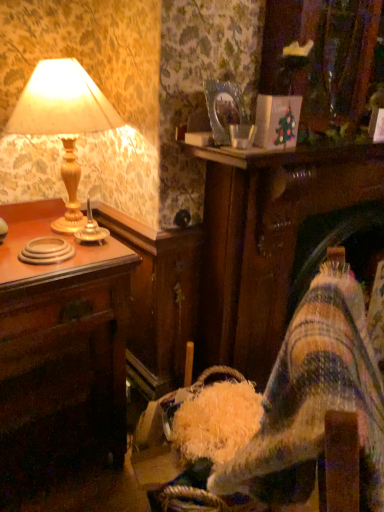
Question: Considering the positions of point (87, 222) and point (39, 87), is point (87, 222) closer or farther from the camera than point (39, 87)?

Choices:
 (A) farther
 (B) closer

Answer: (A)

Question: Considering the positions of gold metallic candle holder at left and matte gold lamp at left in the image, is gold metallic candle holder at left wider or thinner than matte gold lamp at left?

Choices:
 (A) thin
 (B) wide

Answer: (A)

Question: Which of these objects is positioned closest to the gold metallic candle holder at left?

Choices:
 (A) wooden desk at left
 (B) matte gold lamp at left

Answer: (B)

Question: Which is nearer to the matte gold lamp at left?

Choices:
 (A) wooden desk at left
 (B) gold metallic candle holder at left

Answer: (B)